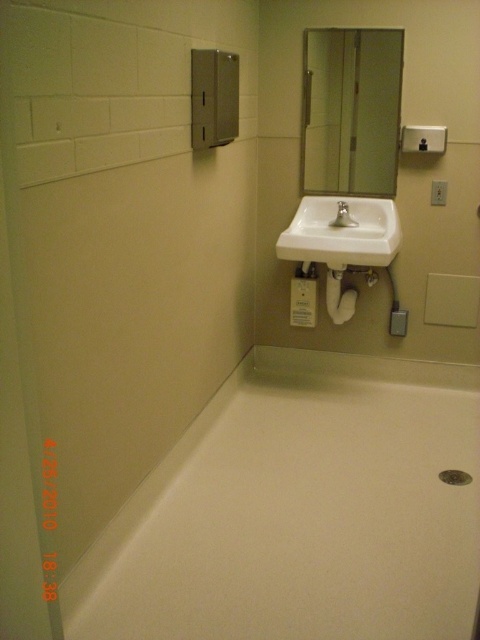
Question: Which point appears farthest from the camera in this image?

Choices:
 (A) (295, 241)
 (B) (454, 620)
 (C) (395, 67)

Answer: (C)

Question: Does white smooth bathtub at lower center appear under white ceramic sink at center?

Choices:
 (A) no
 (B) yes

Answer: (B)

Question: Does white smooth bathtub at lower center have a larger size compared to matte silver faucet at center?

Choices:
 (A) yes
 (B) no

Answer: (A)

Question: Estimate the real-world distances between objects in this image. Which object is farther from the white smooth bathtub at lower center?

Choices:
 (A) clear glass mirror at upper center
 (B) white ceramic sink at center

Answer: (A)

Question: Which of the following is the closest to the observer?

Choices:
 (A) (350, 220)
 (B) (364, 259)
 (C) (260, 608)
 (D) (348, 92)

Answer: (C)

Question: Can you confirm if white ceramic sink at center is wider than matte silver faucet at center?

Choices:
 (A) no
 (B) yes

Answer: (B)